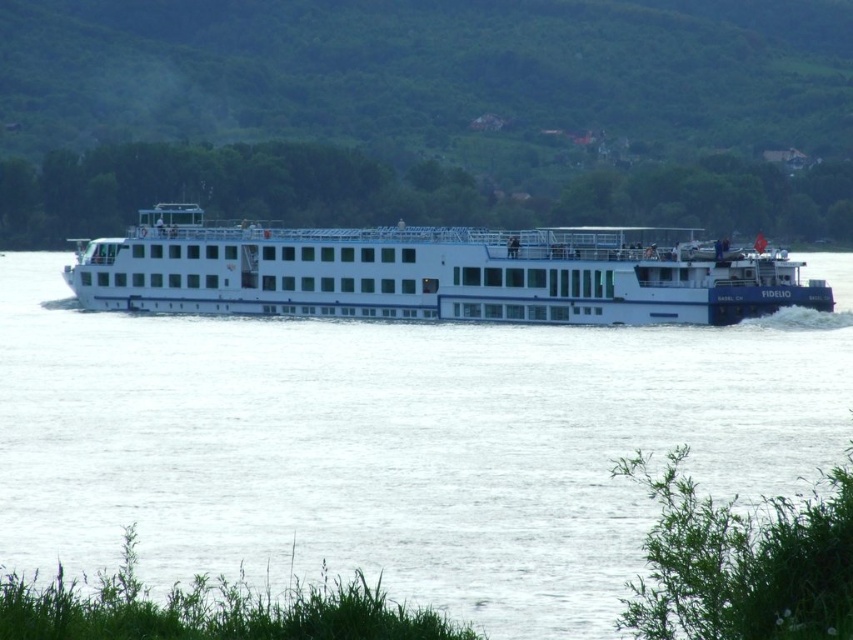
Which of these two, white smooth water at center or white glossy cruise ship at center, stands taller?

Standing taller between the two is white glossy cruise ship at center.

Is white smooth water at center positioned in front of white glossy cruise ship at center?

Yes, white smooth water at center is in front of white glossy cruise ship at center.

Does point (136, 387) come closer to viewer compared to point (335, 300)?

Yes, point (136, 387) is closer to viewer.

Locate an element on the screen. The image size is (853, 640). white smooth water at center is located at coordinates (395, 442).